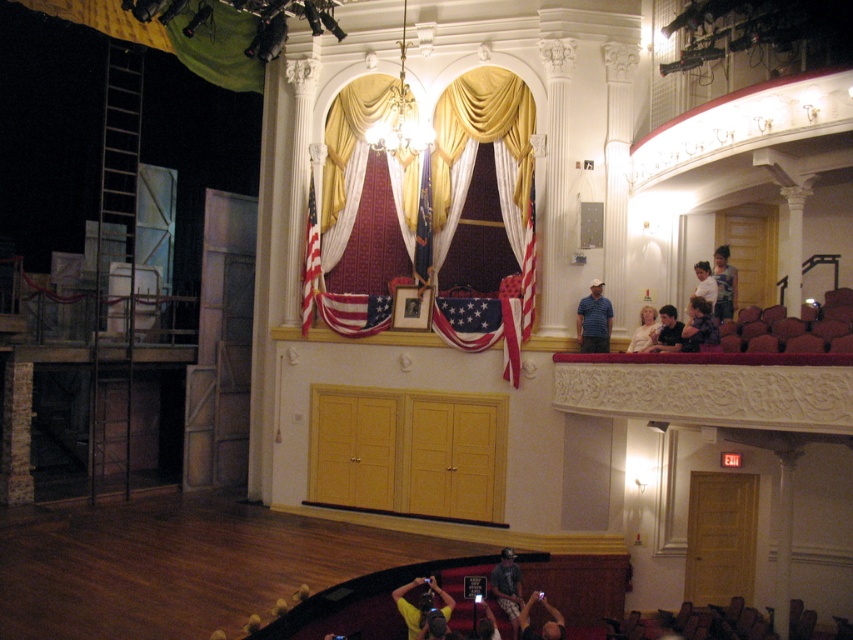
Question: Which object appears farthest from the camera in this image?

Choices:
 (A) dark brown textured shirt at lower center
 (B) light brown hair at upper center

Answer: (B)

Question: Which of the following is the farthest from the observer?

Choices:
 (A) (508, 572)
 (B) (657, 337)
 (C) (709, 296)

Answer: (B)

Question: In this image, where is blue denim jeans at upper center located relative to light brown hair at upper center?

Choices:
 (A) below
 (B) above

Answer: (B)

Question: Which of these objects is positioned farthest from the dark brown textured shirt at lower center?

Choices:
 (A) gold drapery at center
 (B) yellow t-shirt at lower center
 (C) yellow fabric at lower center

Answer: (A)

Question: Is gold drapery at center thinner than dark brown hair at upper right?

Choices:
 (A) yes
 (B) no

Answer: (B)

Question: Does yellow fabric at lower center appear on the right side of white cotton shirt at upper right?

Choices:
 (A) yes
 (B) no

Answer: (B)